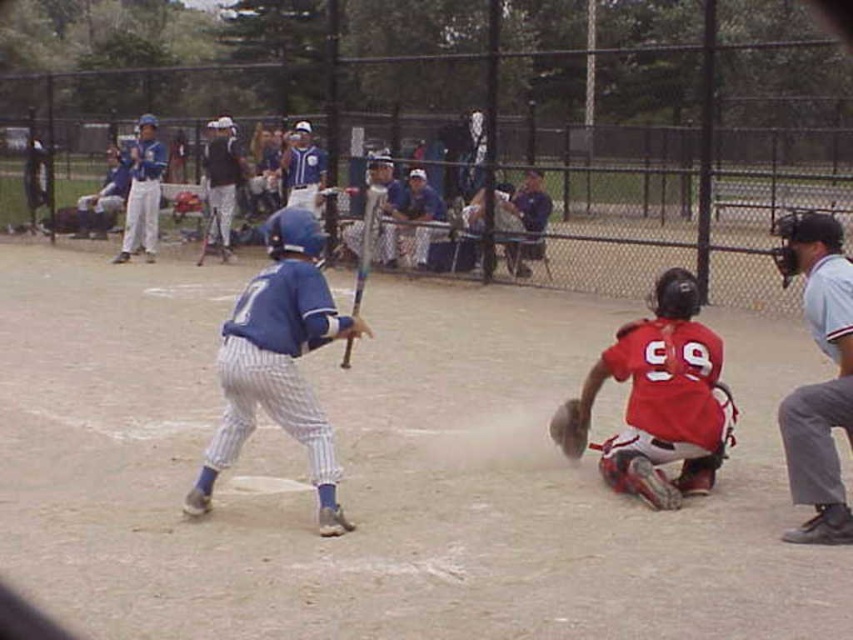
You are a photographer standing at the edge of the field. You want to take a photo that includes both point (506, 268) and point (225, 150). Which point will appear larger in your photo?

Point (506, 268) is closer to the camera than point (225, 150), so it will appear larger in the photo.

You are a groundskeeper at the park and need to place a 10 meter long safety net between the blue matte baseball bat at center and the matte blue uniform at center. Will the net fit between them without exceeding the distance?

The blue matte baseball bat at center and the matte blue uniform at center are 10.34 meters apart from each other. Since the safety net is 10 meters long, it will fit between them as the distance is slightly longer than the net.

You are a photographer standing at the edge of the field. You want to take a picture of the white pinstriped uniform at upper center. According to the scene description, where should you position your camera to capture the subject effectively?

To capture the white pinstriped uniform at upper center effectively, position your camera at the edge of the field facing towards the center, aligning it with the coordinates provided at point 0.345 on the x and 0.569 on the y axis. This ensures the subject is centered in the frame.